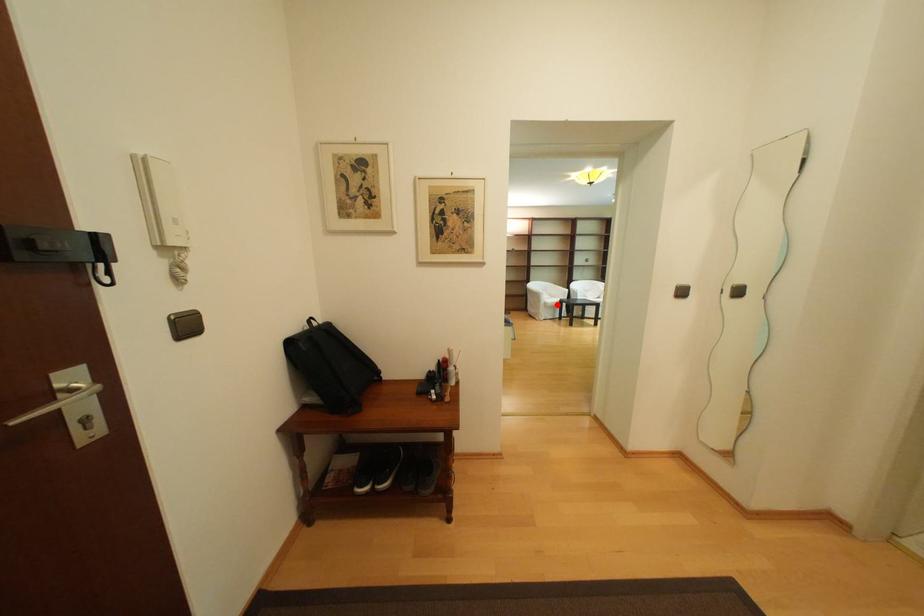
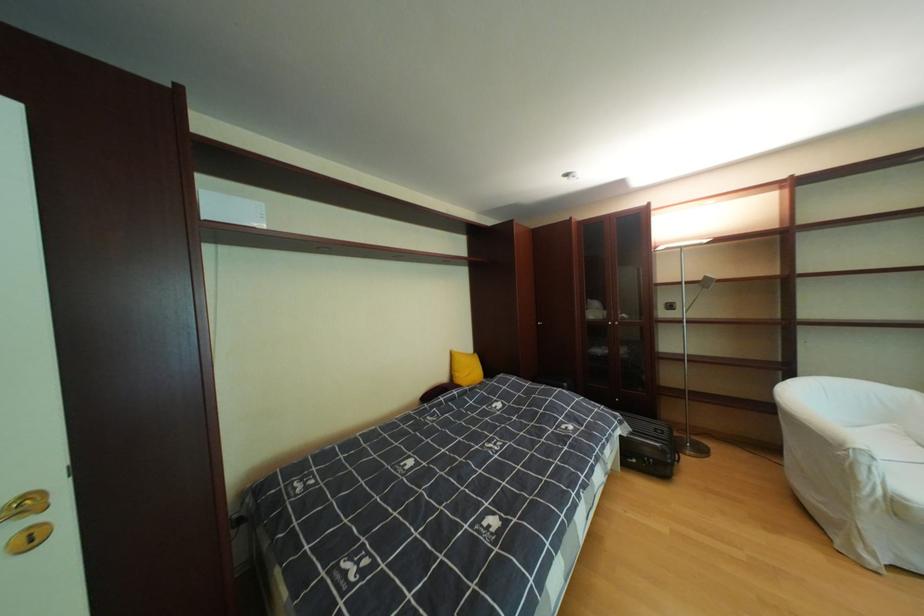
Question: I am providing you with two images of the same scene from different viewpoints. A red point is shown in image1. For the corresponding object point in image2, is it positioned nearer or farther from the camera?

Choices:
 (A) Nearer
 (B) Farther

Answer: (A)